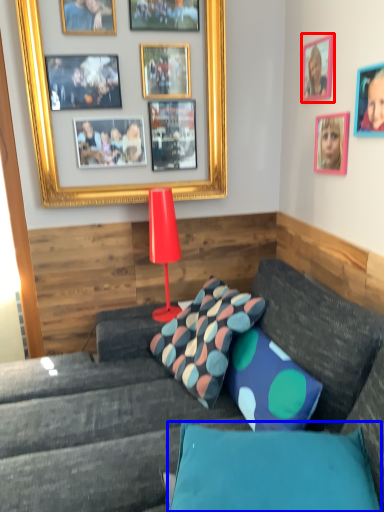
Question: Which of the following is the farthest to the observer, picture frame (highlighted by a red box) or pillow (highlighted by a blue box)?

Choices:
 (A) picture frame
 (B) pillow

Answer: (A)